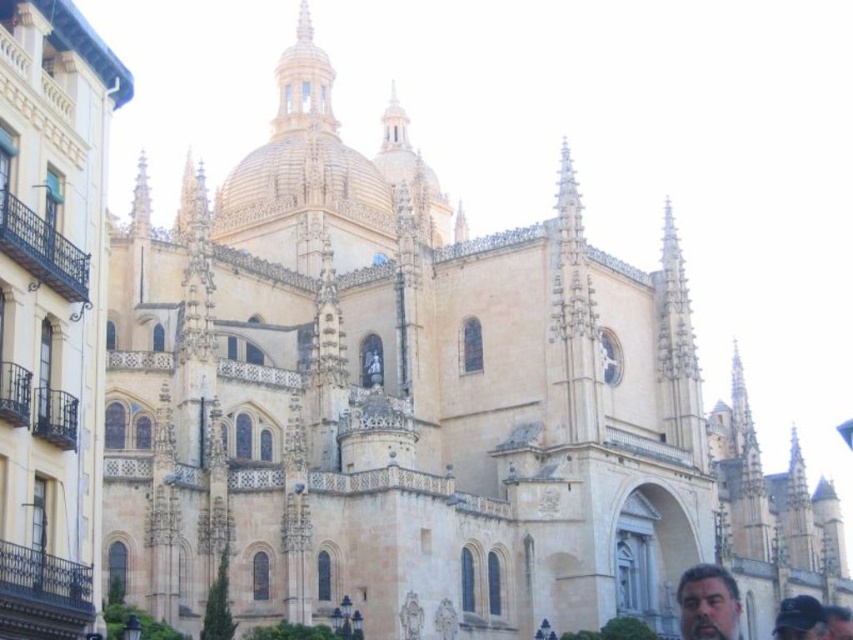
Describe the element at coordinates (706, 604) in the screenshot. This screenshot has height=640, width=853. I see `dark brown hair at lower right` at that location.

Which of these two, dark brown hair at lower right or dark blue fabric cap at lower right, stands shorter?

dark brown hair at lower right is shorter.

This screenshot has height=640, width=853. I want to click on dark brown hair at lower right, so click(x=706, y=604).

Who is higher up, dark brown hair at lower right or dark brown leather cap at lower right?

dark brown hair at lower right is higher up.

Can you confirm if dark brown hair at lower right is wider than dark brown leather cap at lower right?

In fact, dark brown hair at lower right might be narrower than dark brown leather cap at lower right.

Who is more forward, [735,605] or [849,625]?

Positioned in front is point [735,605].

At what (x,y) coordinates should I click in order to perform the action: click on dark brown hair at lower right. Please return your answer as a coordinate pair (x, y). Looking at the image, I should click on (706, 604).

Can you confirm if dark blue fabric cap at lower right is shorter than dark brown leather cap at lower right?

Yes, dark blue fabric cap at lower right is shorter than dark brown leather cap at lower right.

Is point (785, 634) less distant than point (849, 612)?

No, it is not.

The width and height of the screenshot is (853, 640). In order to click on dark blue fabric cap at lower right in this screenshot , I will do `click(799, 618)`.

You are a GUI agent. You are given a task and a screenshot of the screen. Output one action in this format:
    pyautogui.click(x=<x>, y=<y>)
    Task: Click on the dark blue fabric cap at lower right
    This screenshot has height=640, width=853.
    Given the screenshot: What is the action you would take?
    pyautogui.click(x=799, y=618)